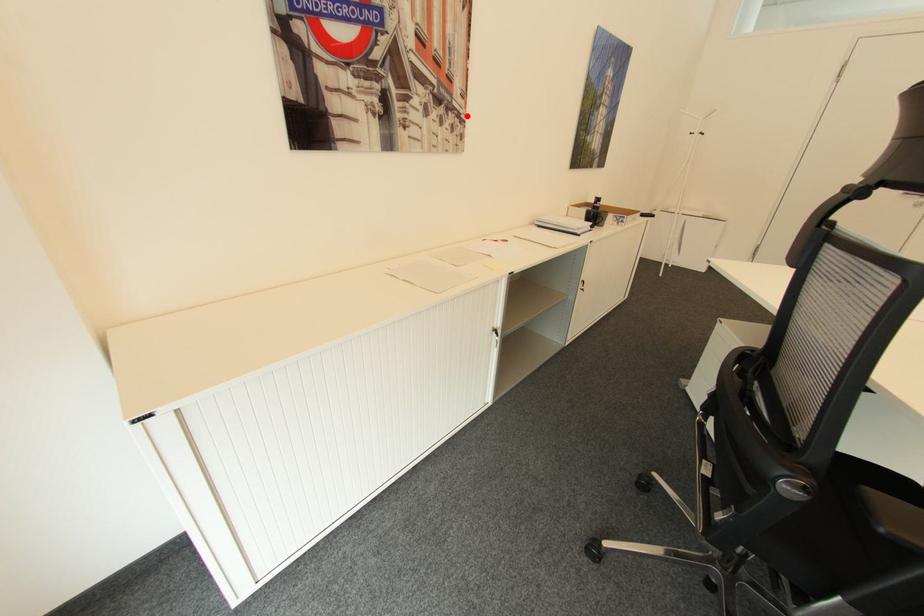
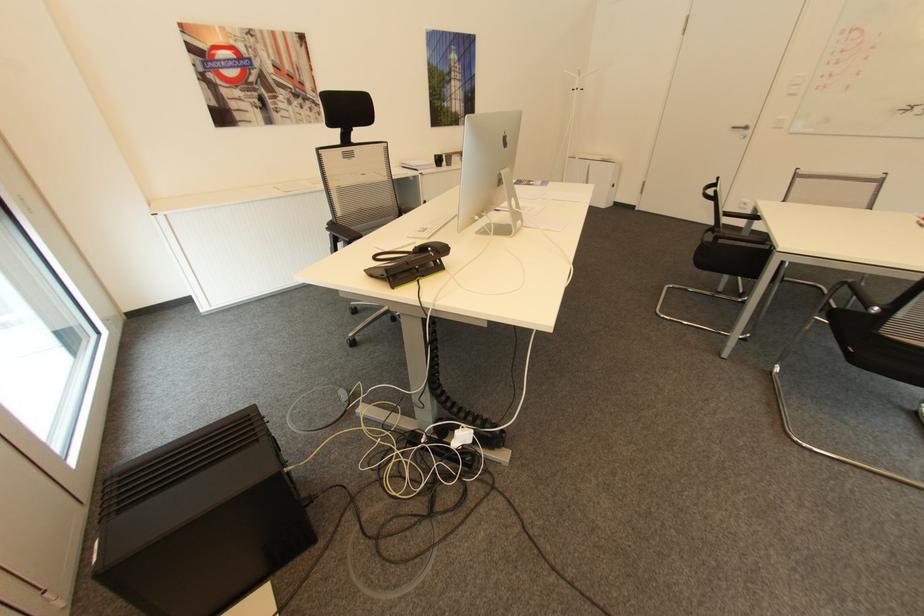
Where in the second image is the point corresponding to the highlighted location from the first image?

(322, 102)